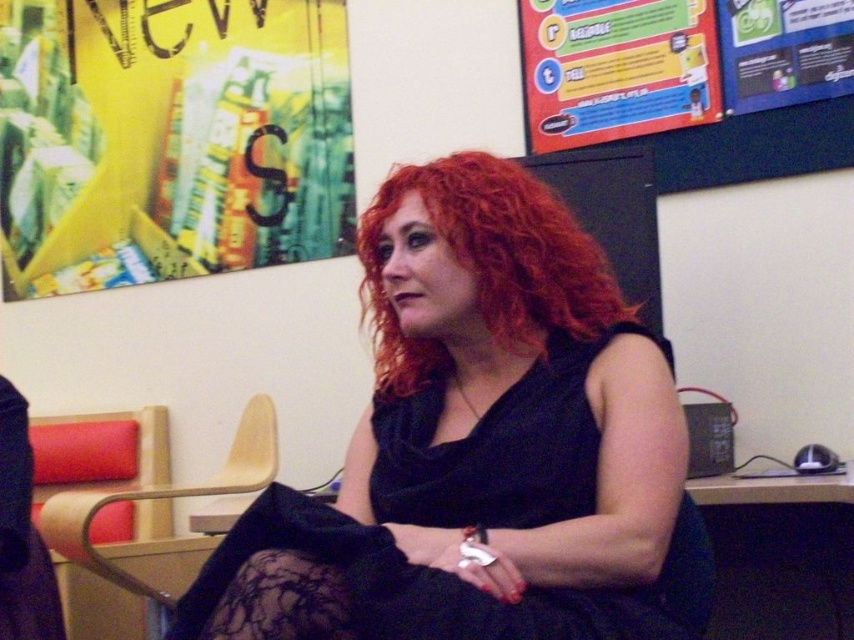
Question: Does curly red hair at center appear on the right side of wooden armchair at left?

Choices:
 (A) no
 (B) yes

Answer: (B)

Question: Can you confirm if black matte dress at center is smaller than yellow paper poster at upper left?

Choices:
 (A) no
 (B) yes

Answer: (B)

Question: Is yellow paper poster at upper left to the right of wooden armchair at left from the viewer's perspective?

Choices:
 (A) yes
 (B) no

Answer: (B)

Question: Which point is farther from the camera taking this photo?

Choices:
 (A) (689, 573)
 (B) (727, 51)
 (C) (648, 125)
 (D) (121, 256)

Answer: (D)

Question: Which point is farther to the camera?

Choices:
 (A) yellow paper poster at upper left
 (B) wooden armchair at left
 (C) matte plastic poster at upper center

Answer: (A)

Question: Which object is closer to the camera taking this photo?

Choices:
 (A) yellow paper poster at upper left
 (B) black matte dress at center
 (C) blue glossy poster at upper right

Answer: (B)